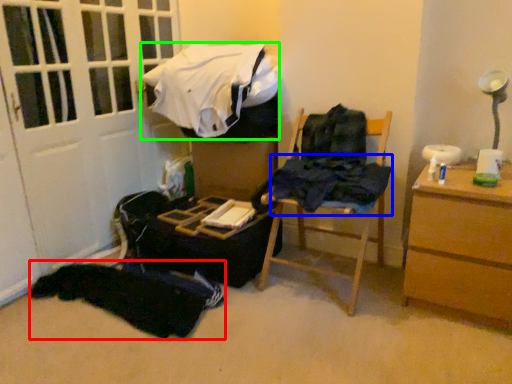
Question: Based on their relative distances, which object is farther from clothing (highlighted by a red box)? Choose from clothing (highlighted by a blue box) and clothing (highlighted by a green box).

Choices:
 (A) clothing
 (B) clothing

Answer: (B)